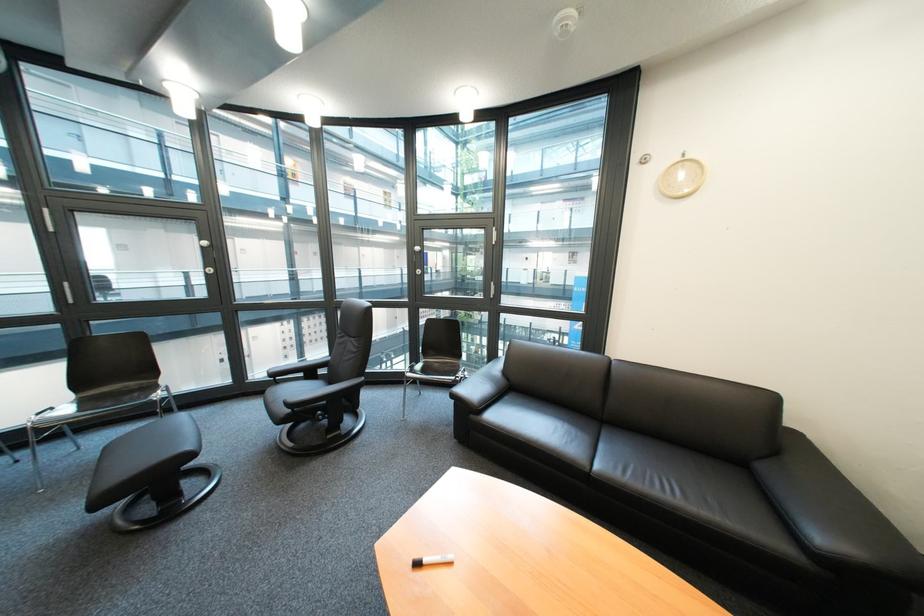
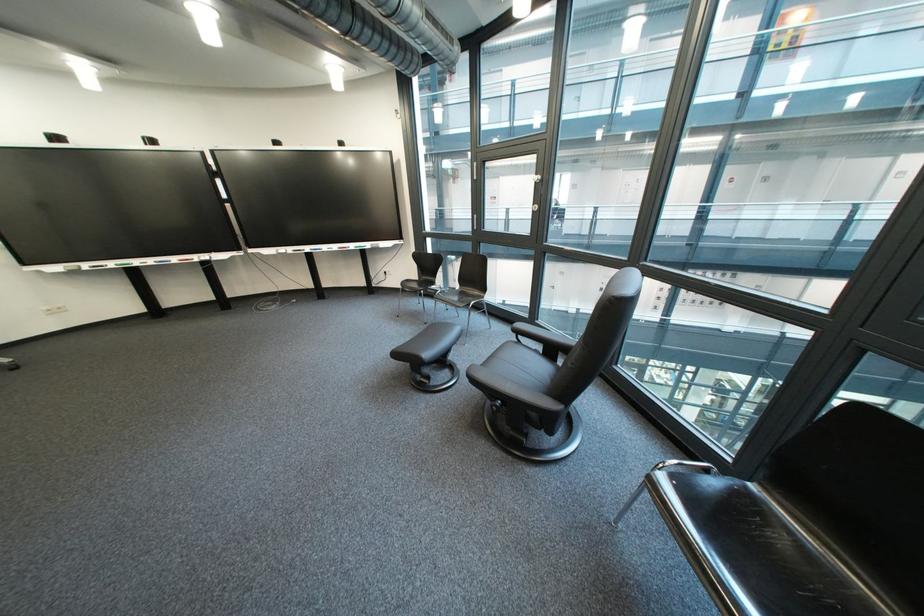
Find the pixel in the second image that matches [331,341] in the first image.

(715, 304)